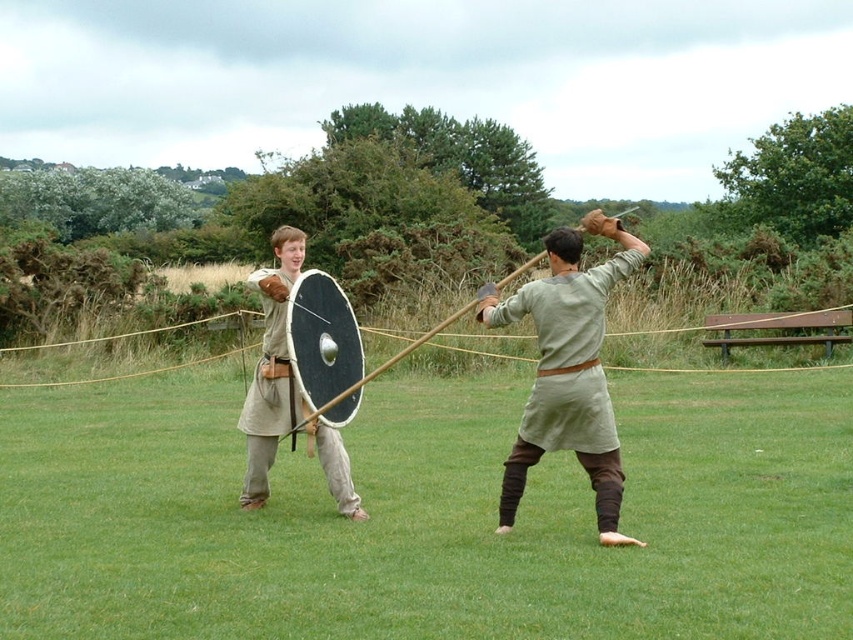
You are a costume designer reviewing the scene. You need to ensure that the light gray fabric sword at center and the light beige fabric shield at center are positioned correctly for safety during the demonstration. According to the description, which object is positioned lower in the image?

The light gray fabric sword at center is positioned below the light beige fabric shield at center, so it is lower in the image.

You are a knight in the middle of a battlefield. You notice the green grass at center and the light beige fabric shield at center. Which object is taller?

The green grass at center is much taller than the light beige fabric shield at center.